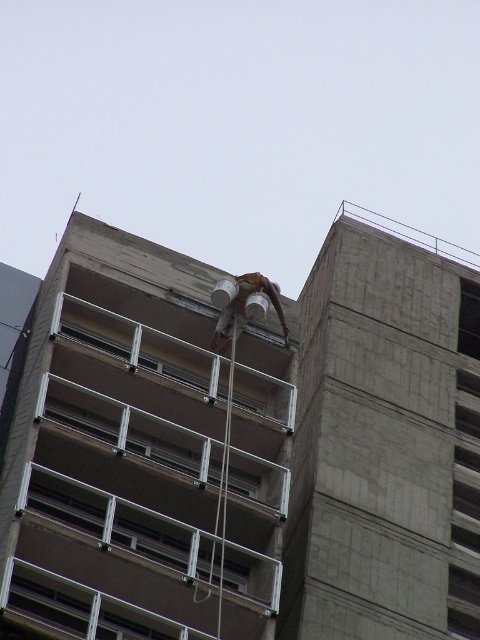
Question: Which point is closer to the camera?

Choices:
 (A) brown leather helmet at center
 (B) brown concrete balcony at center

Answer: (B)

Question: Does brown concrete balcony at center have a smaller size compared to brown leather helmet at center?

Choices:
 (A) no
 (B) yes

Answer: (A)

Question: Does brown concrete balcony at center have a lesser width compared to brown leather helmet at center?

Choices:
 (A) no
 (B) yes

Answer: (A)

Question: Which object is closer to the camera taking this photo?

Choices:
 (A) brown concrete balcony at center
 (B) brown leather helmet at center

Answer: (A)

Question: Can you confirm if brown concrete balcony at center is positioned to the left of brown leather helmet at center?

Choices:
 (A) no
 (B) yes

Answer: (B)

Question: Which point is farther to the camera?

Choices:
 (A) brown concrete balcony at center
 (B) brown leather helmet at center

Answer: (B)